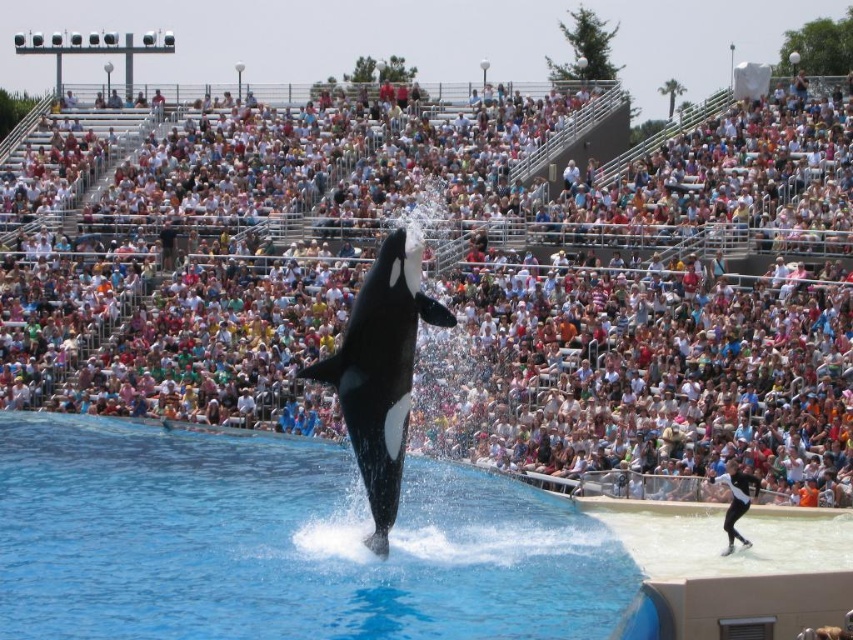
Question: Can you confirm if multicolored fabric crowd at upper center is positioned above black smooth orca at center?

Choices:
 (A) no
 (B) yes

Answer: (B)

Question: Does clear blue water at center have a lesser width compared to black smooth orca at center?

Choices:
 (A) no
 (B) yes

Answer: (A)

Question: Estimate the real-world distances between objects in this image. Which object is closer to the clear blue water at center?

Choices:
 (A) black matte wetsuit at center
 (B) black smooth orca at center
 (C) multicolored fabric crowd at upper center

Answer: (B)

Question: Does multicolored fabric crowd at upper center have a larger size compared to black smooth orca at center?

Choices:
 (A) yes
 (B) no

Answer: (A)

Question: Which object appears closest to the camera in this image?

Choices:
 (A) black matte wetsuit at center
 (B) clear blue water at center
 (C) multicolored fabric crowd at upper center

Answer: (B)

Question: Which point is closer to the camera?

Choices:
 (A) (399, 509)
 (B) (689, 131)
 (C) (347, 358)

Answer: (C)